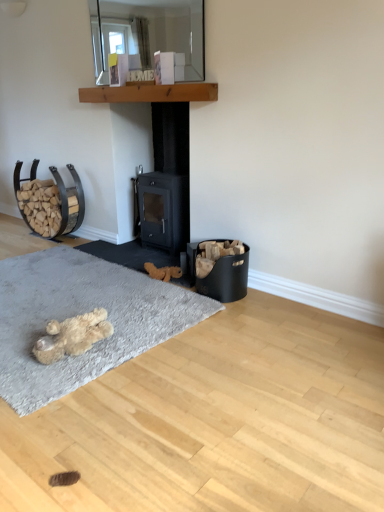
Where is `vacant space in front of fuzzy beige teddy bear at lower left, which appears as the second animal when viewed from the back`? The height and width of the screenshot is (512, 384). vacant space in front of fuzzy beige teddy bear at lower left, which appears as the second animal when viewed from the back is located at coordinates (61, 376).